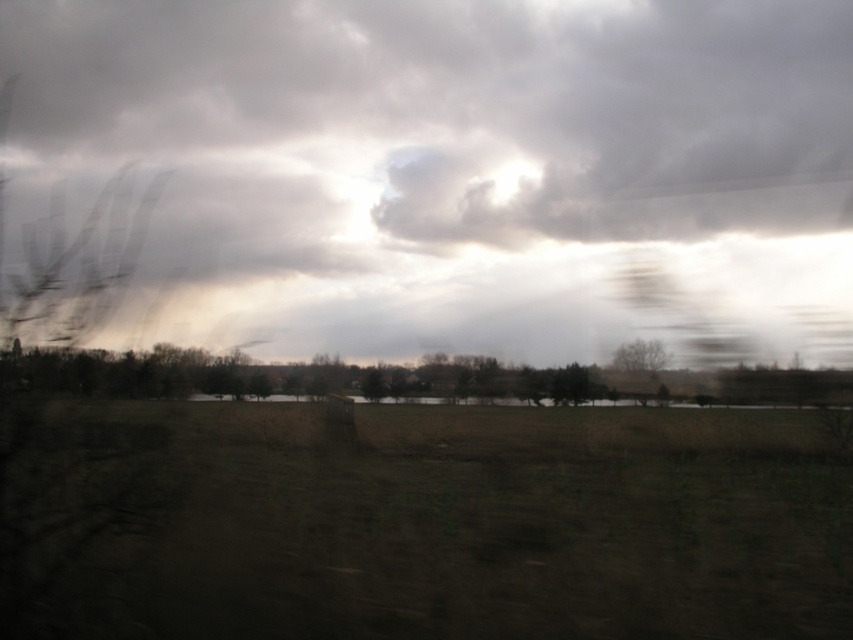
Looking at this image, does cloudy textured sky at center appear on the left side of green matte tree at center?

Incorrect, cloudy textured sky at center is not on the left side of green matte tree at center.

Can you confirm if cloudy textured sky at center is bigger than green matte tree at center?

Yes.

This screenshot has height=640, width=853. What do you see at coordinates (461, 168) in the screenshot?
I see `cloudy textured sky at center` at bounding box center [461, 168].

Where is `cloudy textured sky at center`? cloudy textured sky at center is located at coordinates [x=461, y=168].

Between cloudy textured sky at center and brown matte tree at center-right, which one appears on the left side from the viewer's perspective?

cloudy textured sky at center is more to the left.

Is point (413, 65) positioned behind point (664, 365)?

That is True.

Where is `cloudy textured sky at center`? The image size is (853, 640). cloudy textured sky at center is located at coordinates (461, 168).

How far apart are brown matte tree at center-right and green matte tree at center?

brown matte tree at center-right and green matte tree at center are 4.51 meters apart from each other.

In the scene shown: How much distance is there between brown matte tree at center-right and green matte tree at center?

A distance of 4.51 meters exists between brown matte tree at center-right and green matte tree at center.

The height and width of the screenshot is (640, 853). Describe the element at coordinates (640, 356) in the screenshot. I see `brown matte tree at center-right` at that location.

Image resolution: width=853 pixels, height=640 pixels. What are the coordinates of `brown matte tree at center-right` in the screenshot? It's located at (640, 356).